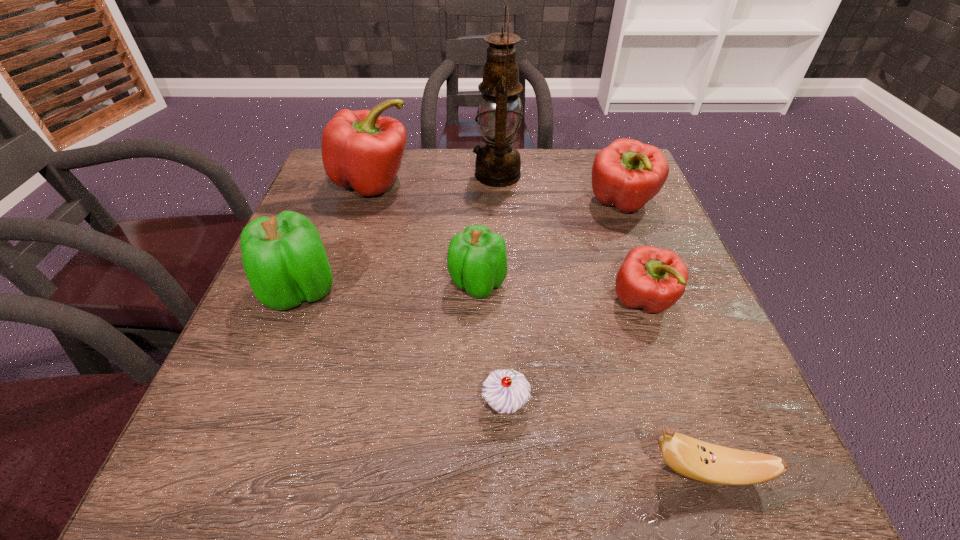
I want to click on the nearest object, so click(692, 458).

Where is `yellow banana`? This screenshot has height=540, width=960. yellow banana is located at coordinates (692, 458).

Where is `vacant region located on the left of the oil lamp`? The width and height of the screenshot is (960, 540). vacant region located on the left of the oil lamp is located at coordinates (440, 174).

Where is `vacant space located on the right of the biggest pink bell pepper`? This screenshot has height=540, width=960. vacant space located on the right of the biggest pink bell pepper is located at coordinates (561, 184).

Locate an element on the screen. vacant space located on the front of the left green bell pepper is located at coordinates (278, 344).

This screenshot has height=540, width=960. Identify the location of vacant space located 0.100m on the front of the second biggest pink bell pepper. (641, 256).

Where is `free region located on the front of the smaller green bell pepper`? This screenshot has width=960, height=540. free region located on the front of the smaller green bell pepper is located at coordinates (476, 434).

Identify the location of vacant space situated 0.250m on the left of the smallest pink bell pepper. This screenshot has height=540, width=960. (482, 302).

Locate an element on the screen. This screenshot has width=960, height=540. free space located on the left of the cupcake is located at coordinates (400, 404).

The width and height of the screenshot is (960, 540). Identify the location of free location located 0.220m on the left of the nearest object. (493, 471).